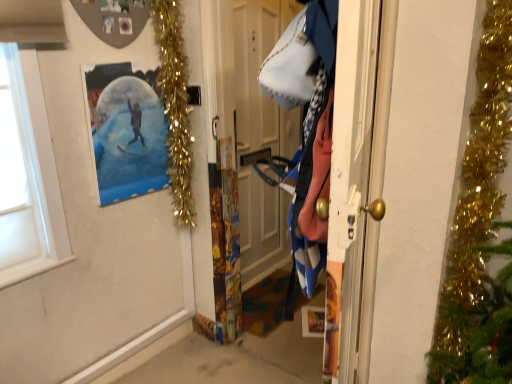
At what (x,y) coordinates should I click in order to perform the action: click on polka dot paper snow globe at upper left. Please return your answer as a coordinate pair (x, y). This screenshot has height=384, width=512. Looking at the image, I should click on (126, 131).

What do you see at coordinates (126, 131) in the screenshot? I see `polka dot paper snow globe at upper left` at bounding box center [126, 131].

At what (x,y) coordinates should I click in order to perform the action: click on wooden door at center. Please return your answer as a coordinate pair (x, y). Looking at the image, I should click on (261, 137).

Is polka dot paper snow globe at upper left located outside blue denim jacket at right?

polka dot paper snow globe at upper left is positioned outside blue denim jacket at right.

Is polka dot paper snow globe at upper left wider or thinner than blue denim jacket at right?

Considering their sizes, polka dot paper snow globe at upper left looks slimmer than blue denim jacket at right.

Between point (106, 84) and point (304, 180), which one is positioned in front?

The point (304, 180) is in front.

From a real-world perspective, which is physically above, blue denim jacket at right or wooden door at center?

blue denim jacket at right is physically above.

In the image, is blue denim jacket at right on the left side or the right side of wooden door at center?

From the image, it's evident that blue denim jacket at right is to the right of wooden door at center.

Which object is more forward, blue denim jacket at right or wooden door at center?

blue denim jacket at right is in front.

Is wooden door at center at the back of blue denim jacket at right?

No.

Considering the sizes of gold tinsel garland at upper left and wooden door at center in the image, is gold tinsel garland at upper left wider or thinner than wooden door at center?

Clearly, gold tinsel garland at upper left has more width compared to wooden door at center.

Between point (161, 100) and point (259, 116), which one is positioned in front?

The point (161, 100) is in front.

Could you tell me if gold tinsel garland at upper left is facing wooden door at center?

No, gold tinsel garland at upper left is not facing towards wooden door at center.

In the scene shown: From the image's perspective, is gold tinsel garland at upper left above or below wooden door at center?

Clearly, from the image's perspective, gold tinsel garland at upper left is above wooden door at center.

From a real-world perspective, is polka dot paper snow globe at upper left positioned above or below gold tinsel garland at upper left?

From a real-world perspective, polka dot paper snow globe at upper left is physically below gold tinsel garland at upper left.

Is polka dot paper snow globe at upper left positioned beyond the bounds of gold tinsel garland at upper left?

Indeed, polka dot paper snow globe at upper left is completely outside gold tinsel garland at upper left.

Who is smaller, polka dot paper snow globe at upper left or gold tinsel garland at upper left?

polka dot paper snow globe at upper left.

From the image's perspective, is polka dot paper snow globe at upper left above gold tinsel garland at upper left?

No, from the image's perspective, polka dot paper snow globe at upper left is not above gold tinsel garland at upper left.

Considering the sizes of objects blue denim jacket at right and polka dot paper snow globe at upper left in the image provided, who is taller, blue denim jacket at right or polka dot paper snow globe at upper left?

blue denim jacket at right is taller.

In the scene shown: From the image's perspective, is blue denim jacket at right under polka dot paper snow globe at upper left?

Yes, from the image's perspective, blue denim jacket at right is below polka dot paper snow globe at upper left.

The image size is (512, 384). What are the coordinates of `clothing below the polka dot paper snow globe at upper left (from the image's perspective)` in the screenshot? It's located at (313, 140).

From a real-world perspective, does wooden door at center stand above blue denim jacket at right?

No, from a real-world perspective, wooden door at center is not on top of blue denim jacket at right.

From the image's perspective, is wooden door at center on top of blue denim jacket at right?

Indeed, from the image's perspective, wooden door at center is shown above blue denim jacket at right.

Does wooden door at center turn towards blue denim jacket at right?

No, wooden door at center is not oriented towards blue denim jacket at right.

Locate an element on the screen. The image size is (512, 384). clothing in front of the wooden door at center is located at coordinates (313, 140).

Identify the location of door above the polka dot paper snow globe at upper left (from the image's perspective). This screenshot has height=384, width=512. (261, 137).

Which is behind, wooden door at center or polka dot paper snow globe at upper left?

wooden door at center is further away from the camera.

Based on the photo, is wooden door at center positioned far away from polka dot paper snow globe at upper left?

Actually, wooden door at center and polka dot paper snow globe at upper left are a little close together.

The width and height of the screenshot is (512, 384). I want to click on picture frame lying behind the blue denim jacket at right, so click(126, 131).

At what (x,y) coordinates should I click in order to perform the action: click on door below the blue denim jacket at right (from a real-world perspective). Please return your answer as a coordinate pair (x, y). Image resolution: width=512 pixels, height=384 pixels. Looking at the image, I should click on (261, 137).

Estimate the real-world distances between objects in this image. Which object is further from wooden door at center, blue denim jacket at right or polka dot paper snow globe at upper left?

Among the two, blue denim jacket at right is located further to wooden door at center.

Considering their positions, is blue denim jacket at right positioned further to wooden door at center than gold tinsel garland at upper left?

blue denim jacket at right lies further to wooden door at center than the other object.

Looking at the image, which one is located further to polka dot paper snow globe at upper left, gold tinsel garland at upper left or wooden door at center?

Among the two, wooden door at center is located further to polka dot paper snow globe at upper left.

Looking at the image, which one is located further to wooden door at center, polka dot paper snow globe at upper left or blue denim jacket at right?

Among the two, blue denim jacket at right is located further to wooden door at center.

Considering their positions, is wooden door at center positioned further to gold tinsel garland at upper left than polka dot paper snow globe at upper left?

wooden door at center lies further to gold tinsel garland at upper left than the other object.

Considering their positions, is polka dot paper snow globe at upper left positioned further to gold tinsel garland at upper left than wooden door at center?

wooden door at center.

From the image, which object appears to be farther from blue denim jacket at right, polka dot paper snow globe at upper left or gold tinsel garland at upper left?

gold tinsel garland at upper left lies further to blue denim jacket at right than the other object.

From the image, which object appears to be nearer to blue denim jacket at right, wooden door at center or gold tinsel garland at upper left?

gold tinsel garland at upper left.

Locate an element on the screen. This screenshot has height=384, width=512. christmas light located between blue denim jacket at right and wooden door at center in the depth direction is located at coordinates (175, 105).

Where is `christmas light located between polka dot paper snow globe at upper left and wooden door at center in the left-right direction`? Image resolution: width=512 pixels, height=384 pixels. christmas light located between polka dot paper snow globe at upper left and wooden door at center in the left-right direction is located at coordinates (175, 105).

This screenshot has width=512, height=384. Find the location of `picture frame between blue denim jacket at right and wooden door at center from front to back`. picture frame between blue denim jacket at right and wooden door at center from front to back is located at coordinates (126, 131).

Identify the location of picture frame between blue denim jacket at right and gold tinsel garland at upper left from front to back. The image size is (512, 384). (126, 131).